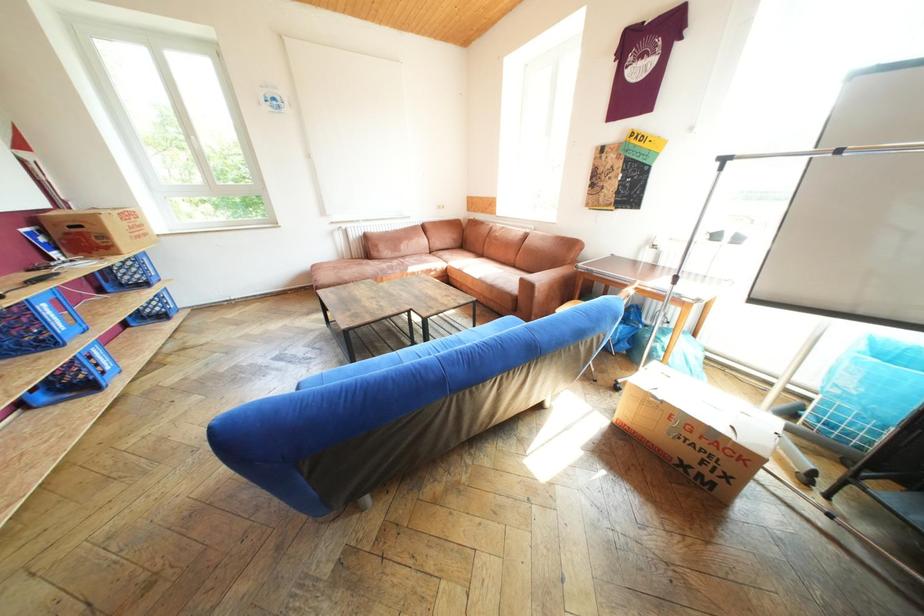
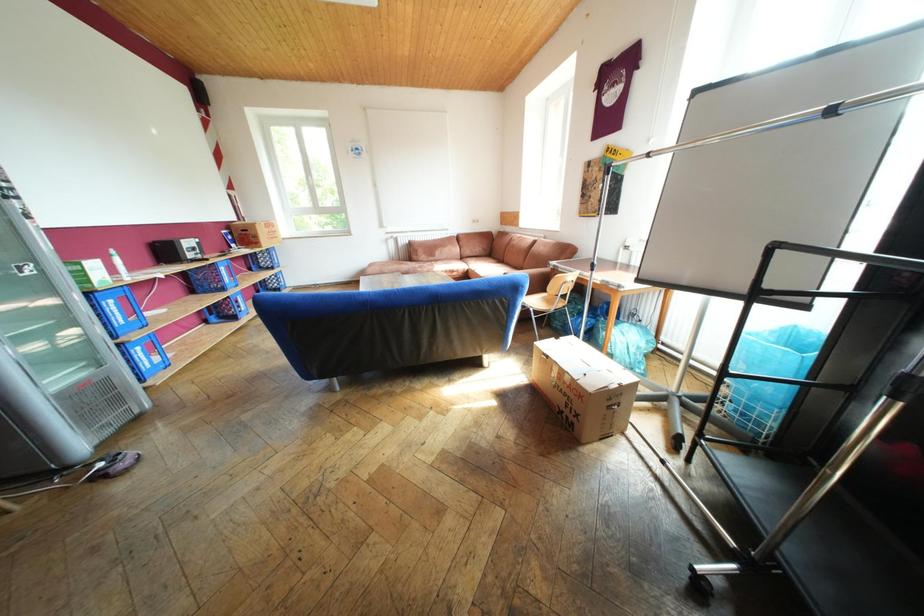
Which direction would the cameraman need to move to produce the second image?

The cameraman moved toward right, backward.